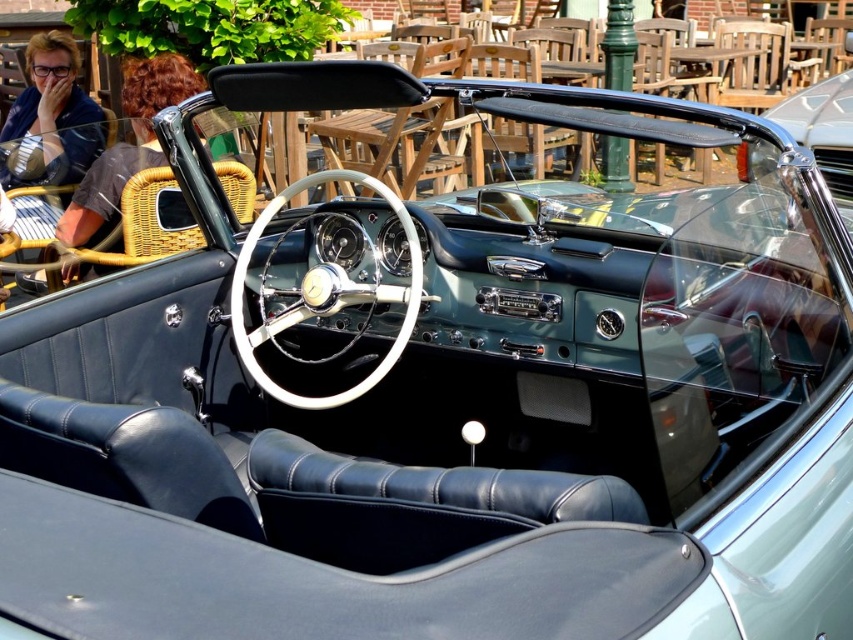
Question: Is shiny silver steering wheel at center below metallic silver steering wheel at center?

Choices:
 (A) no
 (B) yes

Answer: (B)

Question: Which object is closer to the camera taking this photo?

Choices:
 (A) shiny silver steering wheel at center
 (B) metallic silver steering wheel at center

Answer: (A)

Question: Can you confirm if shiny silver steering wheel at center is positioned to the left of metallic silver steering wheel at center?

Choices:
 (A) no
 (B) yes

Answer: (B)

Question: Does shiny silver steering wheel at center have a larger size compared to metallic silver steering wheel at center?

Choices:
 (A) no
 (B) yes

Answer: (A)

Question: Which object is farther from the camera taking this photo?

Choices:
 (A) metallic silver steering wheel at center
 (B) shiny silver steering wheel at center

Answer: (A)